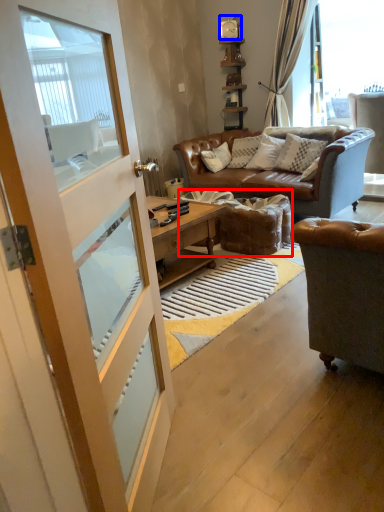
Question: Which object appears closest to the camera in this image, footrest (highlighted by a red box) or clock (highlighted by a blue box)?

Choices:
 (A) footrest
 (B) clock

Answer: (A)